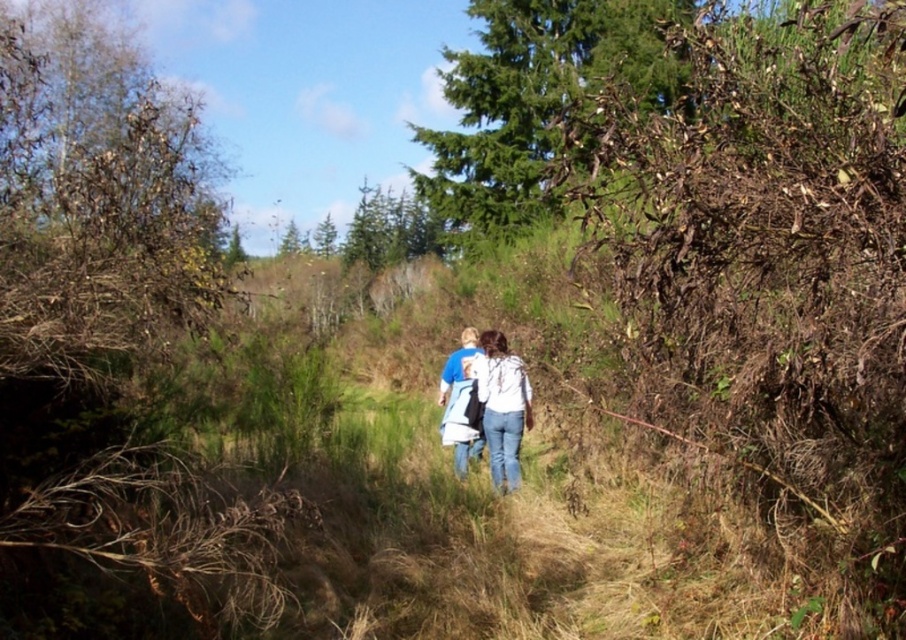
You are standing at the point marked as point (537, 104) in the image. Looking around, you see a green textured tree at upper center. What is directly in front of you at that point?

The green textured tree at upper center is directly in front of you at point (537, 104).

You are standing at the viewpoint where the two people are walking away. You want to take a photo that includes both the green textured tree at upper center and the white cotton shirt at center. Which object should you adjust your camera angle to focus on first to ensure both are in frame?

You should focus on the green textured tree at upper center first because it is wider than the white cotton shirt at center, so capturing its width ensures the shirt will also fit in the frame.

You are standing at the starting point of the path and see the white cotton shirt at center and the green leafy tree at upper center. Which object is closer to you?

The white cotton shirt at center is closer to you because it is in front of the green leafy tree at upper center.